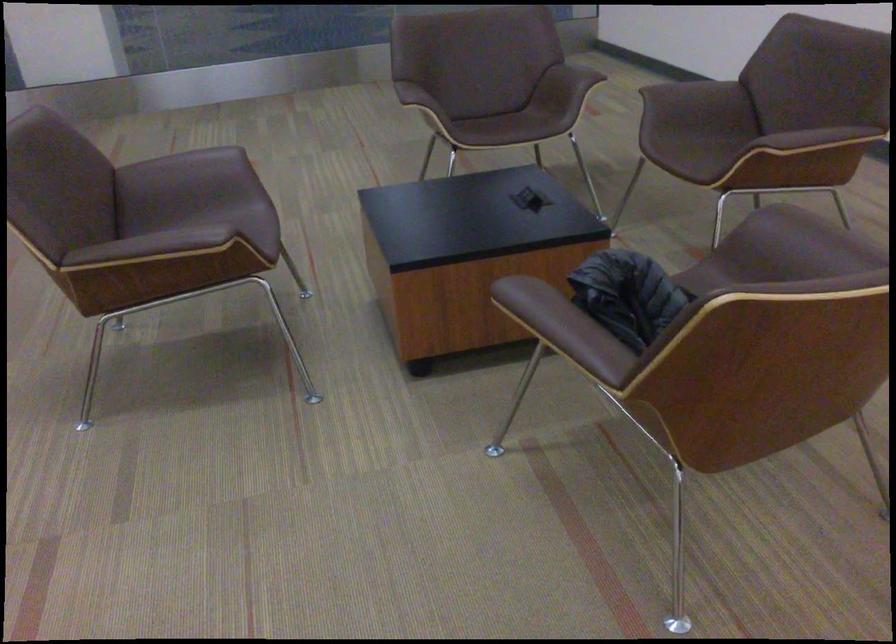
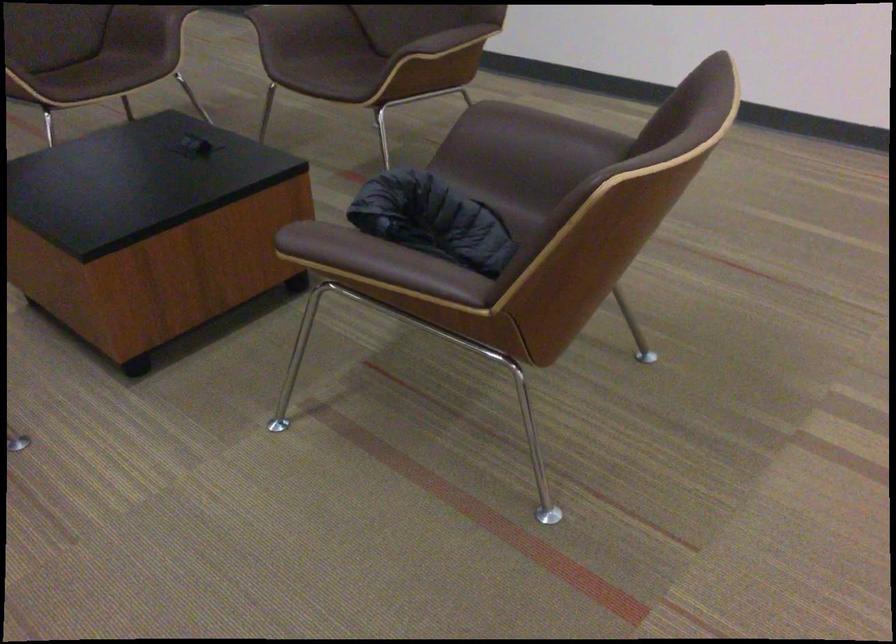
The point at (x=823, y=234) is marked in the first image. Where is the corresponding point in the second image?

(545, 128)